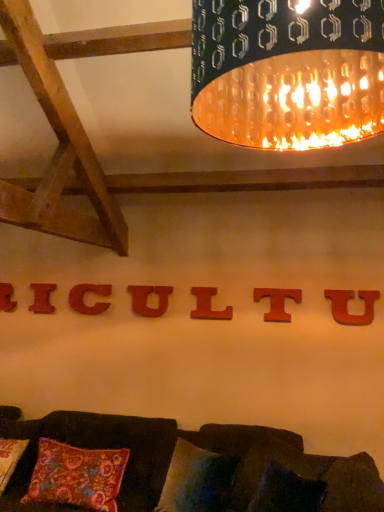
Question: Is wooden letter t at center, acting as the second alphabet starting from the right, at the left side of matte wood letter u at center, placed as the fourth alphabet when sorted from right to left?

Choices:
 (A) yes
 (B) no

Answer: (B)

Question: Is wooden letter t at center, which is counted as the sixth alphabet, starting from the left, thinner than matte wood letter u at center, which is counted as the fourth alphabet, starting from the left?

Choices:
 (A) no
 (B) yes

Answer: (A)

Question: Considering the relative sizes of wooden letter t at center, acting as the second alphabet starting from the right, and matte wood letter u at center, placed as the fourth alphabet when sorted from right to left, in the image provided, is wooden letter t at center, acting as the second alphabet starting from the right, shorter than matte wood letter u at center, placed as the fourth alphabet when sorted from right to left,?

Choices:
 (A) no
 (B) yes

Answer: (A)

Question: Is wooden letter t at center, acting as the second alphabet starting from the right, taller than matte wood letter u at center, which is counted as the fourth alphabet, starting from the left?

Choices:
 (A) yes
 (B) no

Answer: (A)

Question: Is the depth of wooden letter t at center, acting as the second alphabet starting from the right, greater than that of matte wood letter u at center, which is counted as the fourth alphabet, starting from the left?

Choices:
 (A) yes
 (B) no

Answer: (B)

Question: Is wooden letter t at center, which is counted as the sixth alphabet, starting from the left, oriented away from matte wood letter u at center, placed as the fourth alphabet when sorted from right to left?

Choices:
 (A) no
 (B) yes

Answer: (A)

Question: Is velvet dark brown couch at lower center looking in the opposite direction of matte wood letter u at center, placed as the fourth alphabet when sorted from right to left?

Choices:
 (A) yes
 (B) no

Answer: (B)

Question: Can you confirm if velvet dark brown couch at lower center is positioned to the right of matte wood letter u at center, which is counted as the fourth alphabet, starting from the left?

Choices:
 (A) no
 (B) yes

Answer: (A)

Question: Considering the relative positions of velvet dark brown couch at lower center and matte wood letter u at center, which is counted as the fourth alphabet, starting from the left, in the image provided, is velvet dark brown couch at lower center behind matte wood letter u at center, which is counted as the fourth alphabet, starting from the left,?

Choices:
 (A) no
 (B) yes

Answer: (A)

Question: Can we say velvet dark brown couch at lower center lies outside matte wood letter u at center, placed as the fourth alphabet when sorted from right to left?

Choices:
 (A) no
 (B) yes

Answer: (B)

Question: Does velvet dark brown couch at lower center have a greater width compared to matte wood letter u at center, which is counted as the fourth alphabet, starting from the left?

Choices:
 (A) yes
 (B) no

Answer: (A)

Question: From the image's perspective, is velvet dark brown couch at lower center on matte wood letter u at center, placed as the fourth alphabet when sorted from right to left?

Choices:
 (A) yes
 (B) no

Answer: (B)

Question: Does matte wood letter u at center, placed as the fourth alphabet when sorted from right to left, have a smaller size compared to metallic textured lampshade at upper center?

Choices:
 (A) no
 (B) yes

Answer: (B)